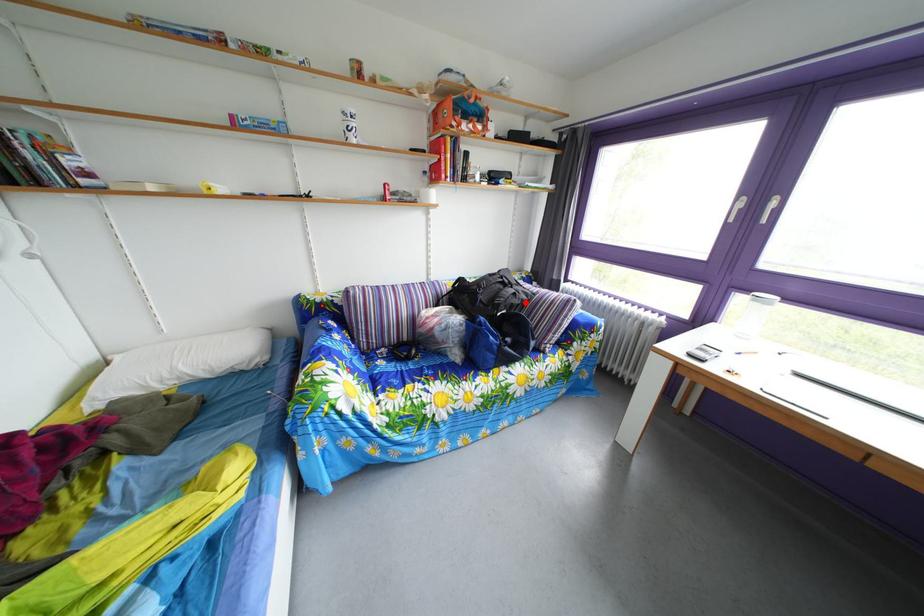
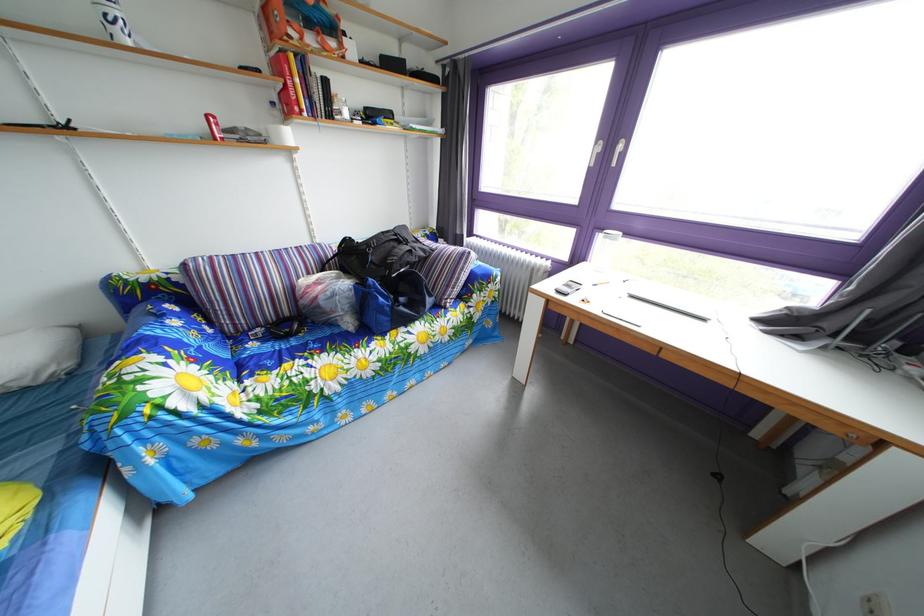
Question: I am providing you with two images of the same scene from different viewpoints. A red point is shown in image1. For the corresponding object point in image2, is it positioned nearer or farther from the camera?

Choices:
 (A) Nearer
 (B) Farther

Answer: (A)